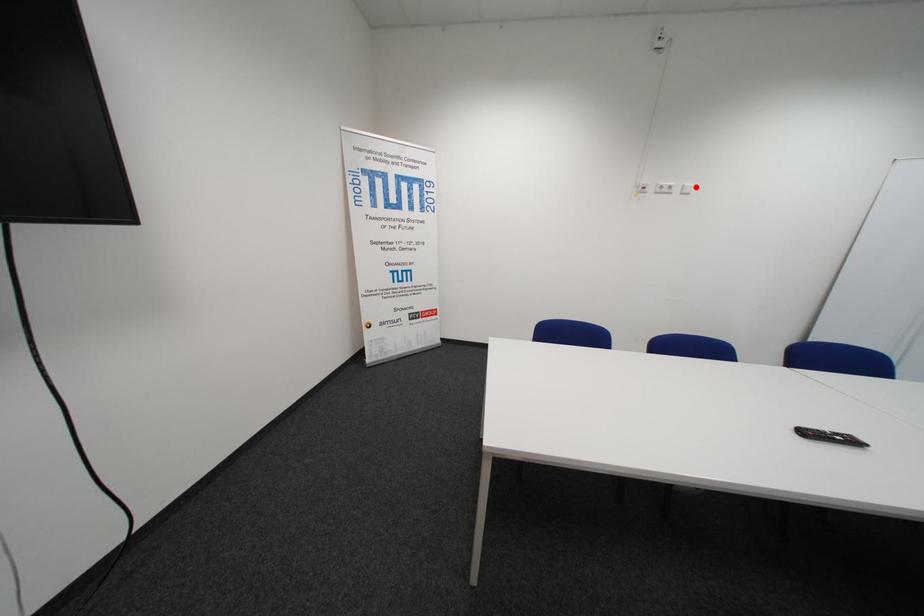
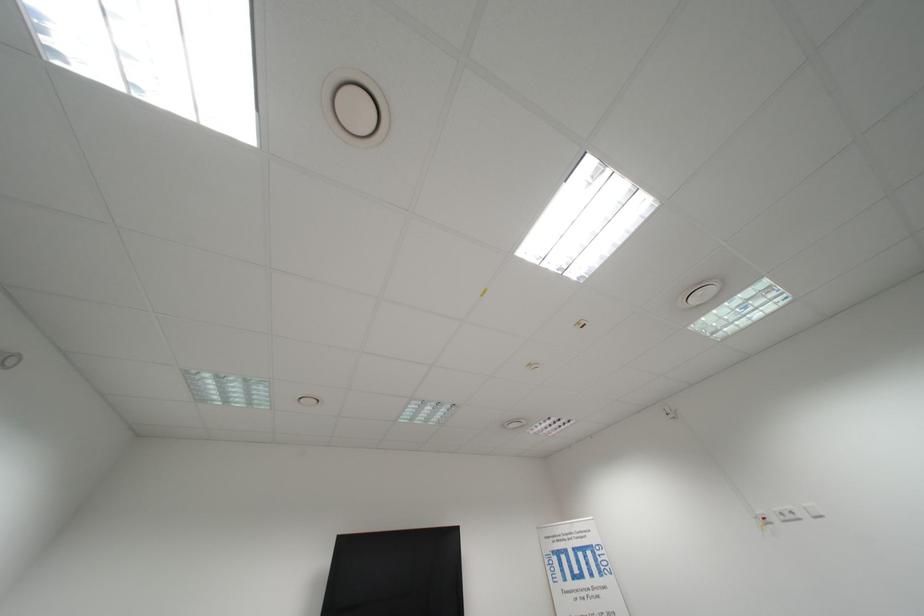
Find the pixel in the second image that matches the highlighted location in the first image.

(818, 509)